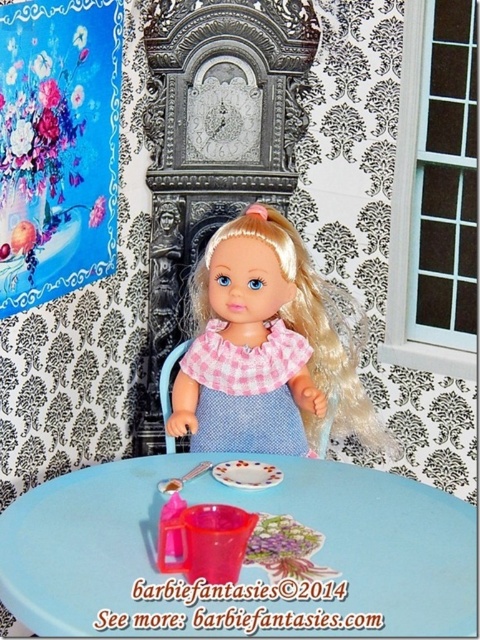
Is pink checkered fabric doll at center shorter than pink checkered fabric dress at center?

No.

Does pink checkered fabric doll at center appear on the right side of pink checkered fabric dress at center?

Yes, pink checkered fabric doll at center is to the right of pink checkered fabric dress at center.

Which is behind, point (259, 259) or point (220, 417)?

Point (220, 417)

Find the location of a particular element. pink checkered fabric doll at center is located at coordinates (265, 349).

Where is `blue plastic table at center`? This screenshot has height=640, width=480. blue plastic table at center is located at coordinates (245, 550).

Which is below, blue plastic table at center or pink checkered fabric dress at center?

blue plastic table at center is lower down.

Which is behind, point (36, 584) or point (205, 426)?

The point (205, 426) is behind.

Where is `blue plastic table at center`? The image size is (480, 640). blue plastic table at center is located at coordinates [245, 550].

Does blue plastic table at center have a lesser height compared to pink checkered fabric doll at center?

Yes.

Does blue plastic table at center appear on the right side of pink checkered fabric doll at center?

No, blue plastic table at center is not to the right of pink checkered fabric doll at center.

Is point (428, 548) farther from viewer compared to point (285, 248)?

No, (428, 548) is closer to viewer.

Where is `blue plastic table at center`? Image resolution: width=480 pixels, height=640 pixels. blue plastic table at center is located at coordinates (245, 550).